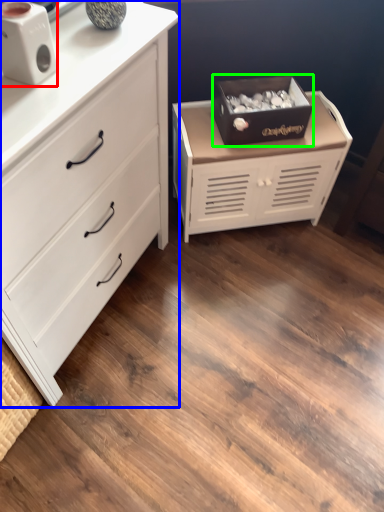
Question: Based on their relative distances, which object is farther from speaker (highlighted by a red box)? Choose from chest of drawers (highlighted by a blue box) and storage box (highlighted by a green box).

Choices:
 (A) chest of drawers
 (B) storage box

Answer: (B)